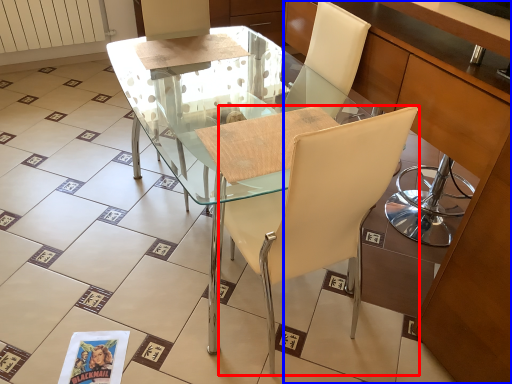
Question: Which object appears farthest to the camera in this image, chair (highlighted by a red box) or cabinetry (highlighted by a blue box)?

Choices:
 (A) chair
 (B) cabinetry

Answer: (B)